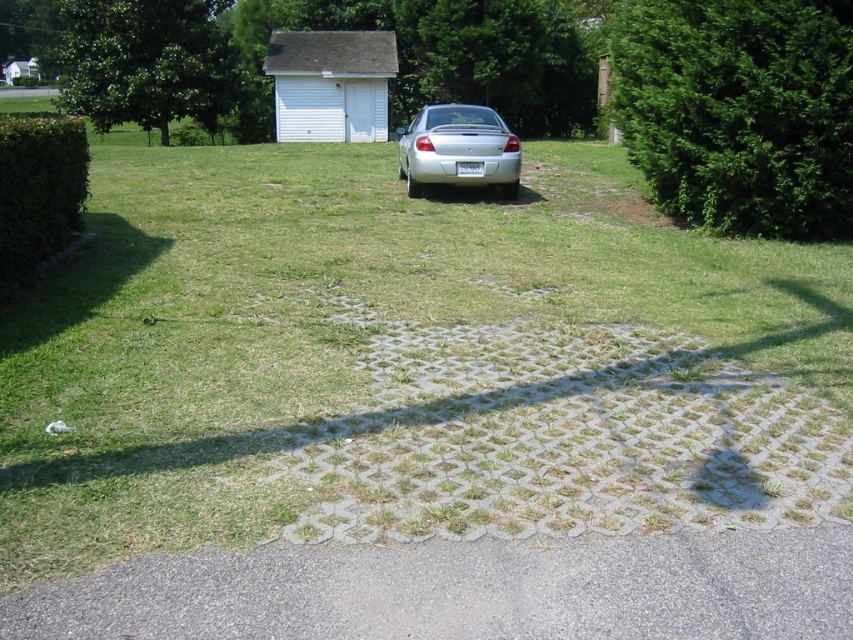
You are a gardener planning to mow the lawn. You see the gray asphalt driveway at lower center and the green leafy hedge at left. Which object is closer to the ground?

The gray asphalt driveway at lower center is closer to the ground because it is below the green leafy hedge at left.

You are standing at the point labeled point (611, 605) in the image. You want to walk towards the camera. How far will you have to walk to reach the camera?

The distance between point (611, 605) and the camera is 3.25 meters, so you will have to walk 3.25 meters to reach the camera.

You are standing at point (x=798, y=86) and want to walk to the driveway. Which direction should you go to reach the driveway first, towards point (x=527, y=604) or away from it?

You should go towards point (x=527, y=604) because it is in front of point (x=798, y=86), meaning it is closer to the driveway.